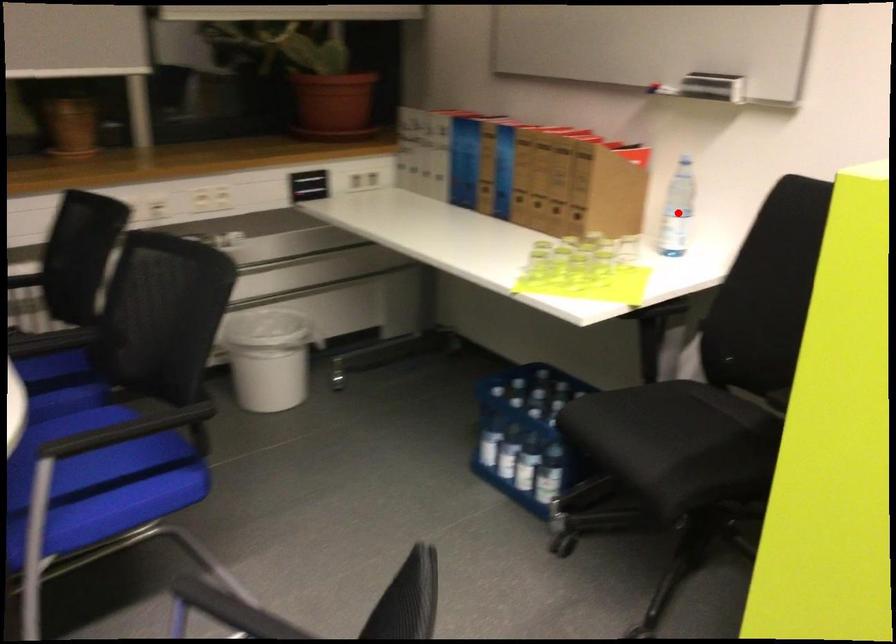
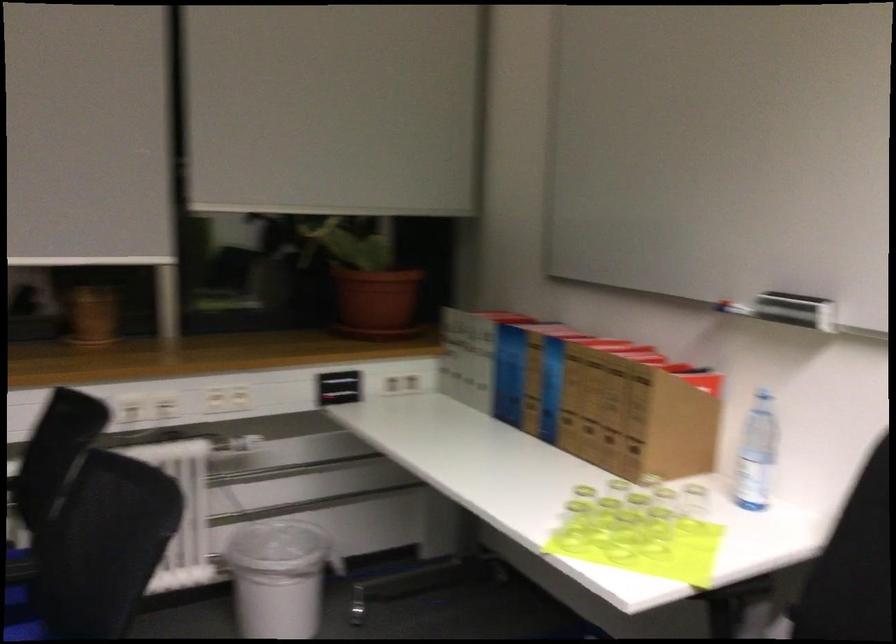
Locate, in the second image, the point that corresponds to the highlighted location in the first image.

(755, 453)